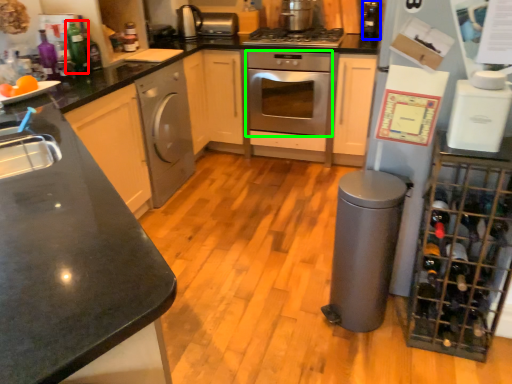
Question: Which object is the farthest from bottle (highlighted by a red box)? Choose among these: bottle (highlighted by a blue box) or oven (highlighted by a green box).

Choices:
 (A) bottle
 (B) oven

Answer: (A)